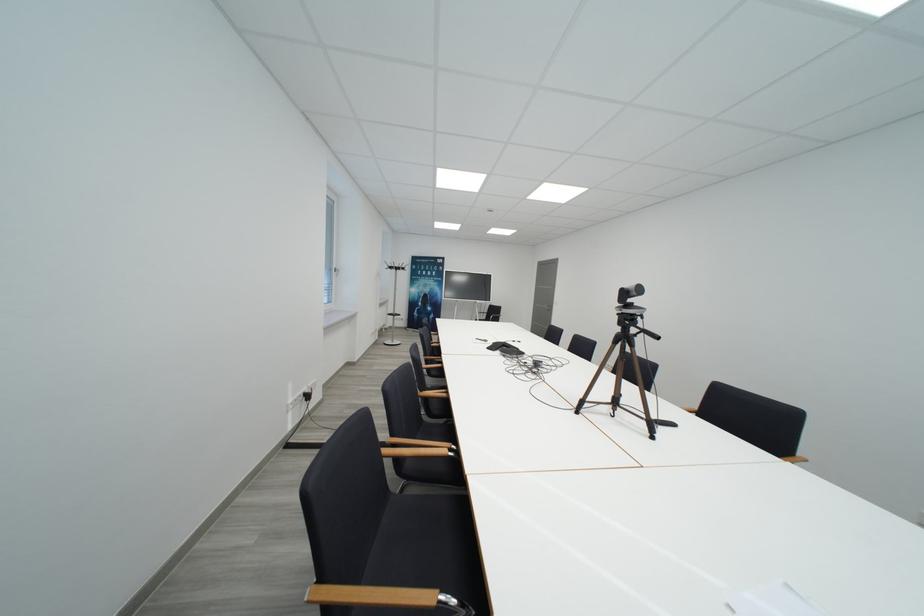
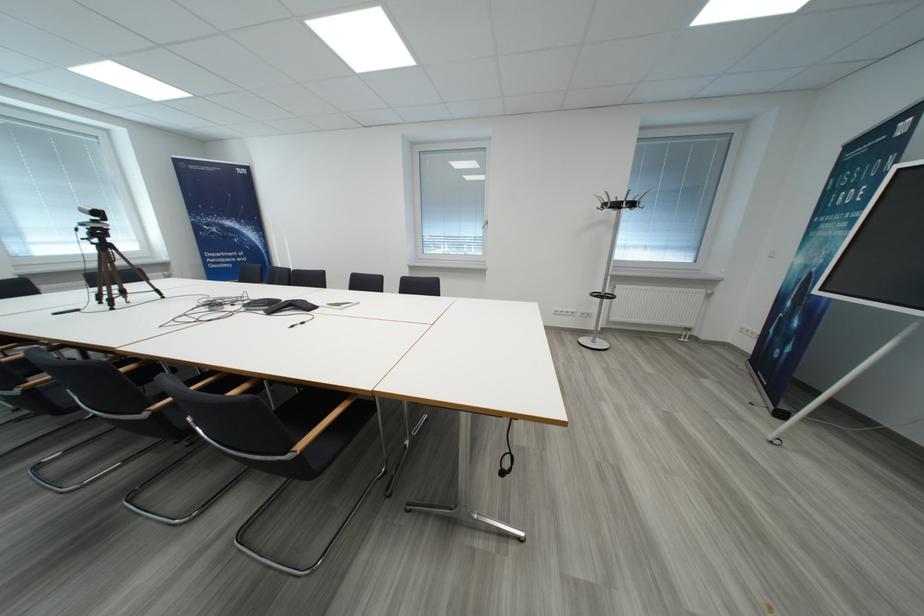
Find the pixel in the second image that matches (410,272) in the first image.

(623, 208)